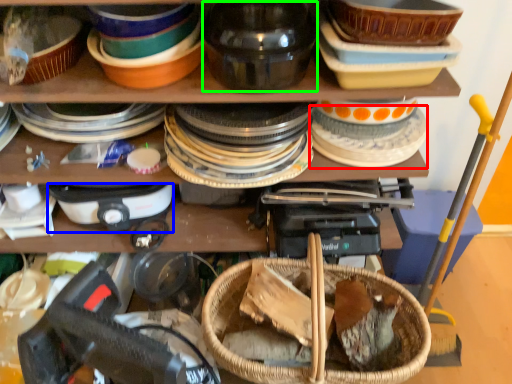
Question: Which object is positioned closest to tableware (highlighted by a red box)? Select from appliance (highlighted by a blue box) and tableware (highlighted by a green box).

Choices:
 (A) appliance
 (B) tableware

Answer: (B)